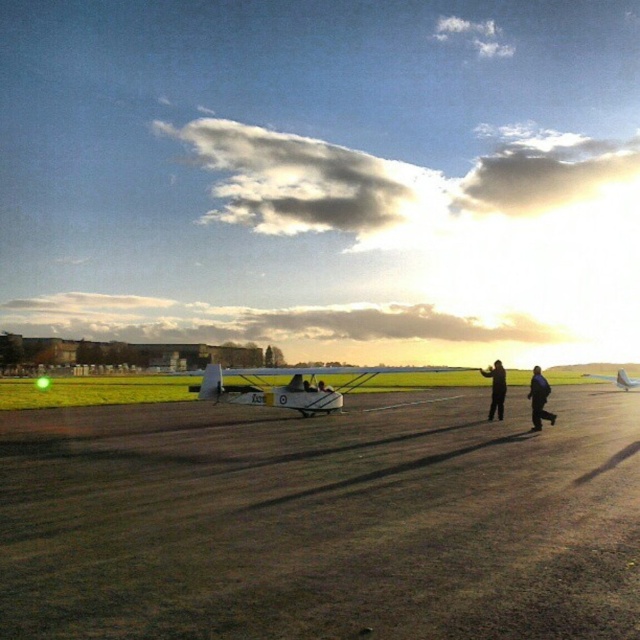
You are standing at the edge of the airfield looking towards the sunset. There are two points marked on the image. Which point, point 1 at coordinates (340, 406) or point 2 at (500, 380), is closer to you?

Point 1 at coordinates (340, 406) is closer to you because it is further to the viewer than point 2 at (500, 380).